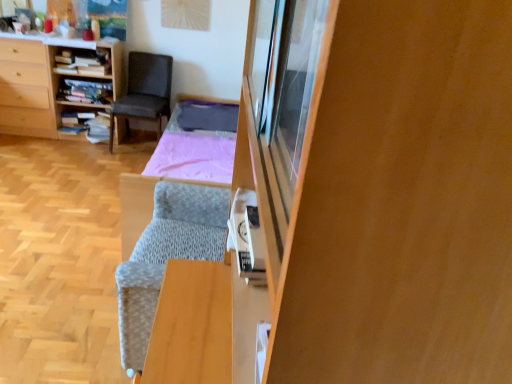
Question: From the image's perspective, does wooden bookshelf at left appear higher than wooden cabinet at right?

Choices:
 (A) yes
 (B) no

Answer: (A)

Question: Considering the relative positions of wooden bookshelf at left and wooden cabinet at right in the image provided, is wooden bookshelf at left behind wooden cabinet at right?

Choices:
 (A) yes
 (B) no

Answer: (A)

Question: Considering the relative positions of wooden bookshelf at left and wooden cabinet at right in the image provided, is wooden bookshelf at left to the left of wooden cabinet at right from the viewer's perspective?

Choices:
 (A) no
 (B) yes

Answer: (B)

Question: Does wooden bookshelf at left have a smaller size compared to wooden cabinet at right?

Choices:
 (A) yes
 (B) no

Answer: (B)

Question: Is wooden bookshelf at left not inside wooden cabinet at right?

Choices:
 (A) yes
 (B) no

Answer: (A)

Question: Considering the positions of wooden bookshelf at upper left, which is the 3th shelf in bottom-to-top order, and wooden bookshelf at center, which is counted as the second shelf, starting from the top, in the image, is wooden bookshelf at upper left, which is the 3th shelf in bottom-to-top order, taller or shorter than wooden bookshelf at center, which is counted as the second shelf, starting from the top,?

Choices:
 (A) short
 (B) tall

Answer: (B)

Question: Based on their sizes in the image, would you say wooden bookshelf at upper left, which is the 3th shelf in bottom-to-top order, is bigger or smaller than wooden bookshelf at center, acting as the 2th shelf starting from the bottom?

Choices:
 (A) big
 (B) small

Answer: (A)

Question: Is wooden bookshelf at upper left, the 1th shelf from the top, wider or thinner than wooden bookshelf at center, which is counted as the second shelf, starting from the top?

Choices:
 (A) wide
 (B) thin

Answer: (B)

Question: Do you think wooden bookshelf at upper left, the 1th shelf from the top, is within wooden bookshelf at center, acting as the 2th shelf starting from the bottom, or outside of it?

Choices:
 (A) inside
 (B) outside

Answer: (B)

Question: Considering the positions of point (99, 109) and point (482, 13), is point (99, 109) closer or farther from the camera than point (482, 13)?

Choices:
 (A) closer
 (B) farther

Answer: (B)

Question: From their relative heights in the image, would you say wooden bookshelf at left, which appears as the third shelf when viewed from the top, is taller or shorter than wooden cabinet at right?

Choices:
 (A) short
 (B) tall

Answer: (A)

Question: In terms of width, does wooden bookshelf at left, which appears as the third shelf when viewed from the top, look wider or thinner when compared to wooden cabinet at right?

Choices:
 (A) thin
 (B) wide

Answer: (B)

Question: Considering their positions, is wooden bookshelf at left, which appears as the third shelf when viewed from the top, located in front of or behind wooden cabinet at right?

Choices:
 (A) behind
 (B) front

Answer: (A)

Question: Considering the positions of wooden bookshelf at center, acting as the 2th shelf starting from the bottom, and wooden bookshelf at upper left, which is the 3th shelf in bottom-to-top order, in the image, is wooden bookshelf at center, acting as the 2th shelf starting from the bottom, bigger or smaller than wooden bookshelf at upper left, which is the 3th shelf in bottom-to-top order,?

Choices:
 (A) small
 (B) big

Answer: (A)

Question: Relative to wooden bookshelf at upper left, the 1th shelf from the top, is wooden bookshelf at center, acting as the 2th shelf starting from the bottom, in front or behind?

Choices:
 (A) behind
 (B) front

Answer: (A)